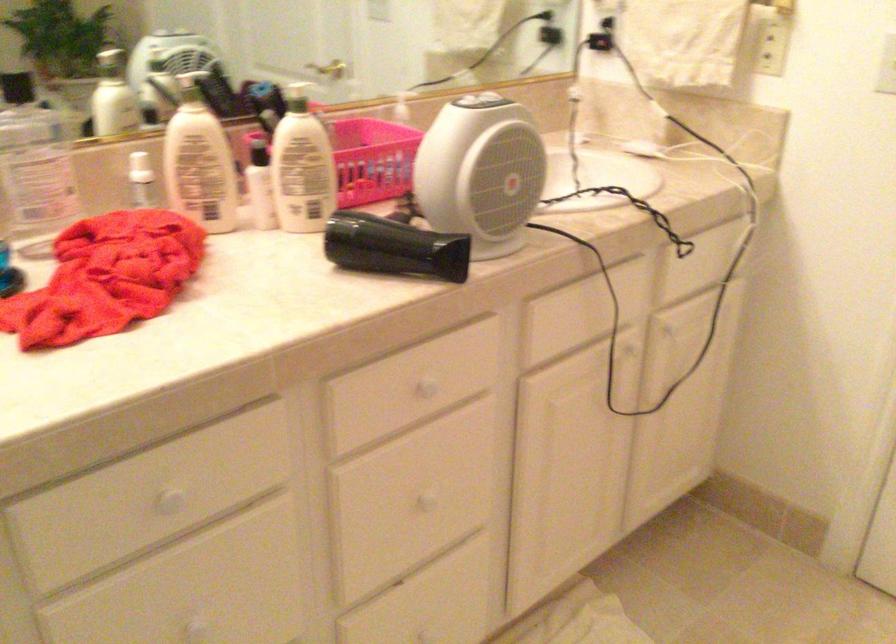
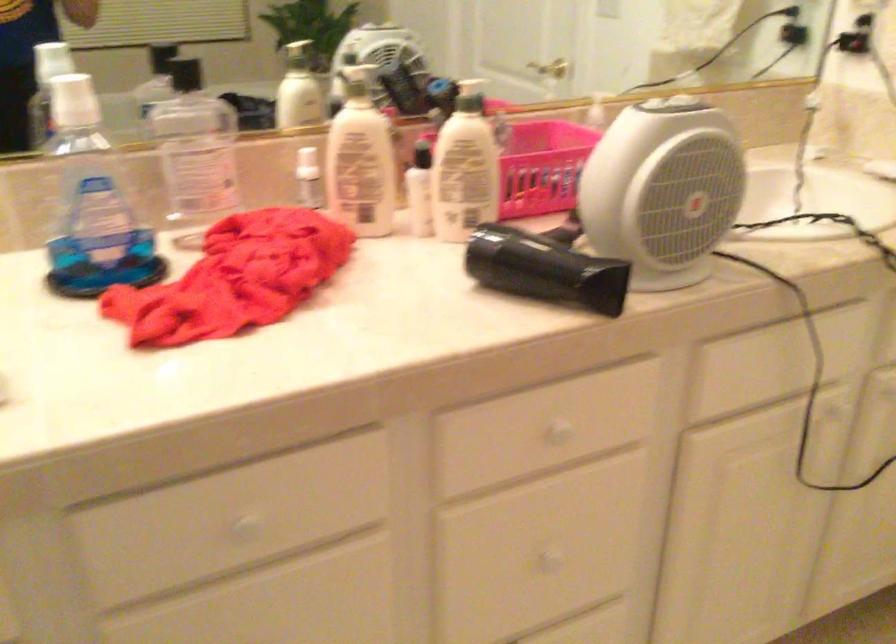
The images are taken continuously from a first-person perspective. In which direction are you moving?

The cameraman walked toward right, forward.